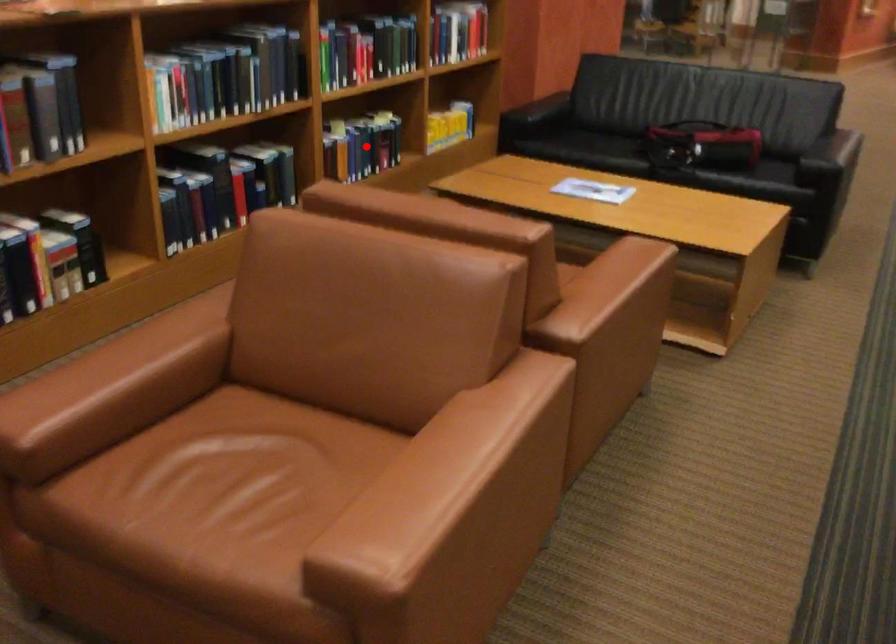
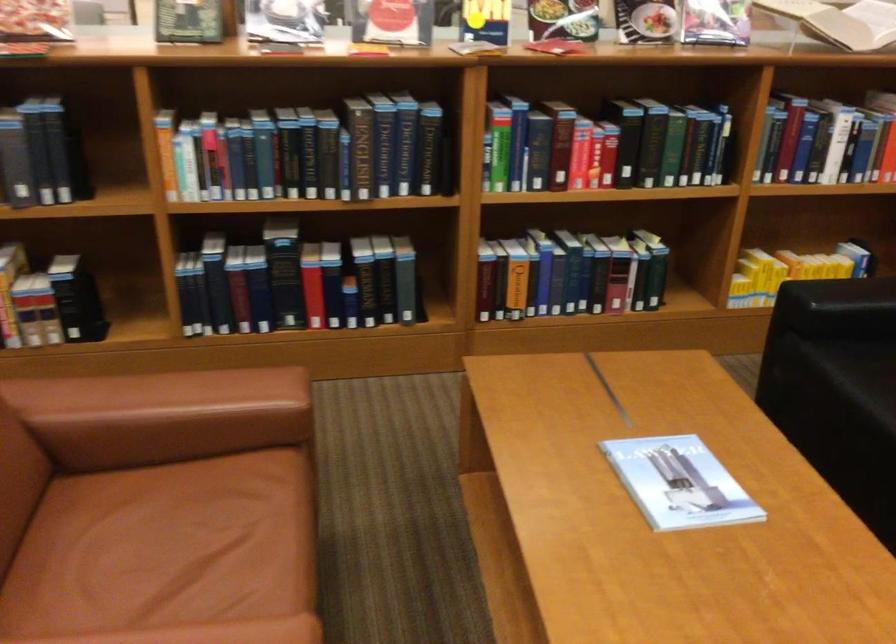
Question: I am providing you with two images of the same scene from different viewpoints. Given a red point in image1, look at the same physical point in image2. Is it:

Choices:
 (A) Closer to the viewpoint
 (B) Farther from the viewpoint

Answer: (A)